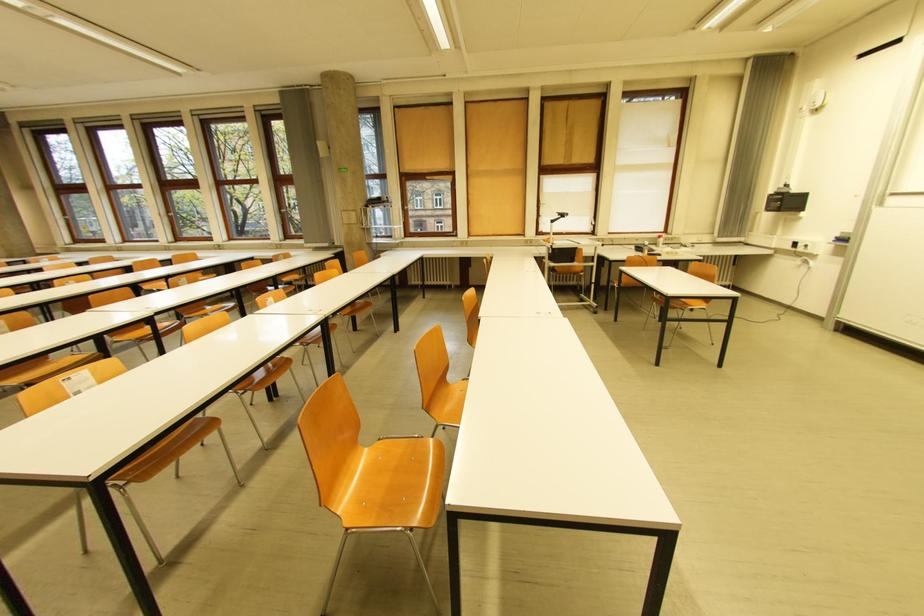
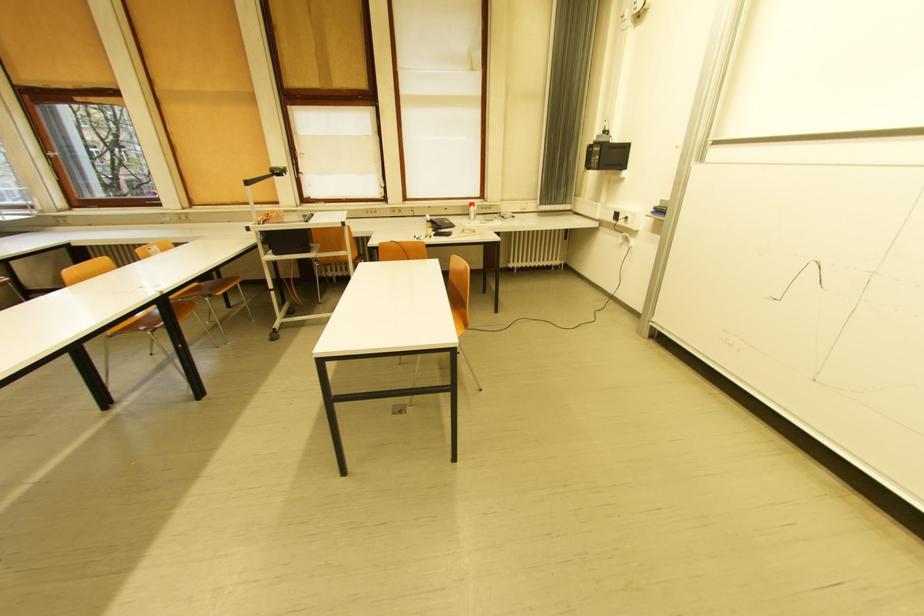
The point at (652, 245) is marked in the first image. Where is the corresponding point in the second image?

(434, 219)